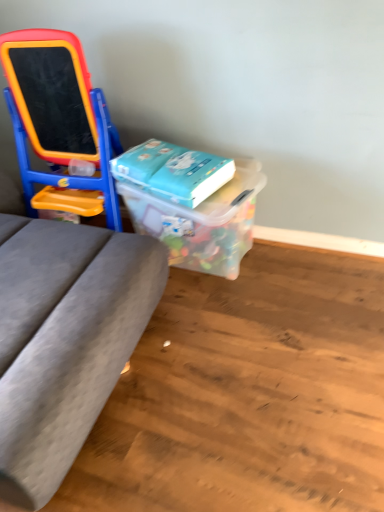
Locate an element on the screen. The image size is (384, 512). free area below translucent plastic container at center (from a real-world perspective) is located at coordinates (207, 275).